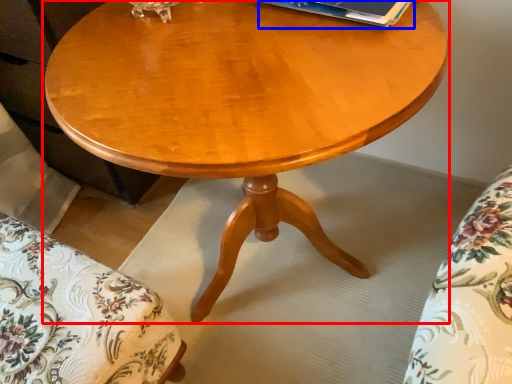
Question: Which object appears farthest to the camera in this image, coffee table (highlighted by a red box) or paperback book (highlighted by a blue box)?

Choices:
 (A) coffee table
 (B) paperback book

Answer: (B)